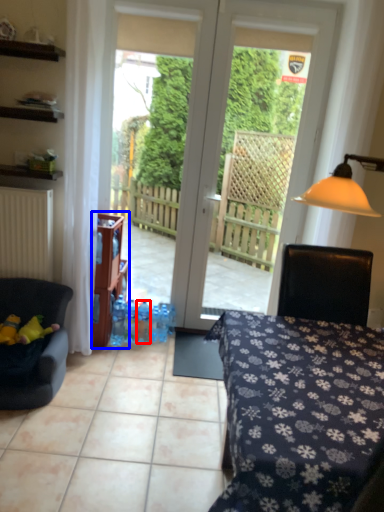
Question: Which of the following is the closest to the observer, bottle (highlighted by a red box) or shelf (highlighted by a blue box)?

Choices:
 (A) bottle
 (B) shelf

Answer: (B)